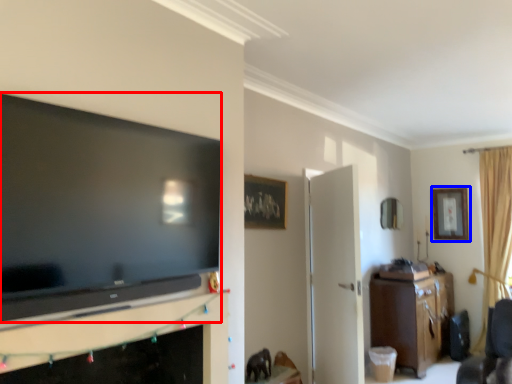
Question: Which object is further to the camera taking this photo, television (highlighted by a red box) or picture frame (highlighted by a blue box)?

Choices:
 (A) television
 (B) picture frame

Answer: (B)